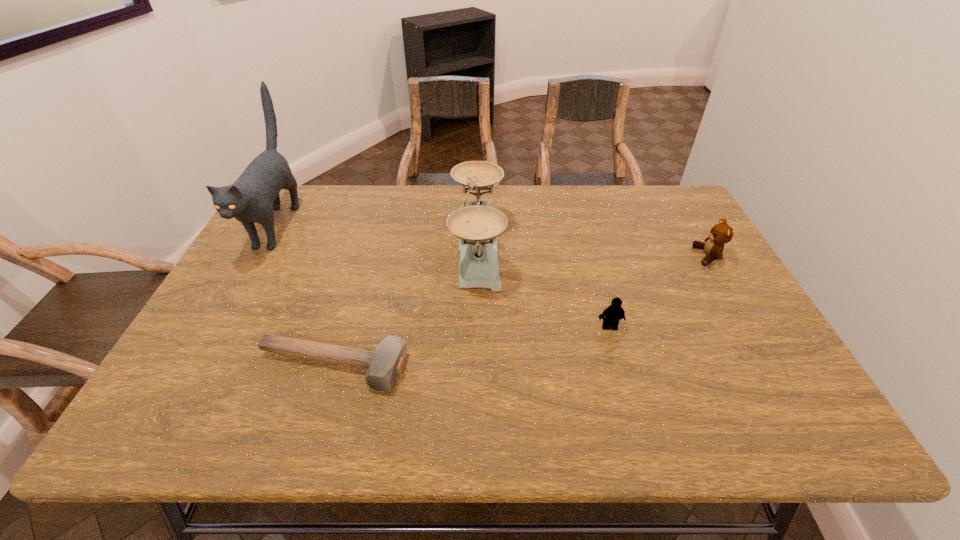
Find the location of a particular element. object that is at the right edge is located at coordinates (721, 233).

Where is `object located at the far left corner`? object located at the far left corner is located at coordinates (252, 198).

Locate an element on the screen. free space at the far edge of the desktop is located at coordinates pos(420,203).

Identify the location of vacant region at the near edge of the desktop. The width and height of the screenshot is (960, 540). (448, 436).

Identify the location of vacant point at the left edge. This screenshot has width=960, height=540. (257, 229).

Where is `vacant space at the right edge of the desktop`? This screenshot has height=540, width=960. vacant space at the right edge of the desktop is located at coordinates tap(706, 308).

I want to click on free space that is in between the third object from left to right and the tallest object, so click(377, 237).

You are a GUI agent. You are given a task and a screenshot of the screen. Output one action in this format:
    pyautogui.click(x=<x>, y=<y>)
    Task: Click on the free point between the third shortest object and the second object from left to right
    This screenshot has width=960, height=540.
    Given the screenshot: What is the action you would take?
    pyautogui.click(x=520, y=312)

In order to click on free point between the mallet and the rightmost object in this screenshot , I will do [520, 312].

Locate an element on the screen. The width and height of the screenshot is (960, 540). free space between the fourth object from left to right and the mallet is located at coordinates (470, 347).